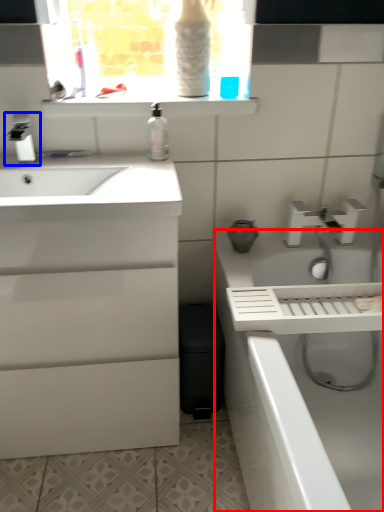
Question: Which point is further to the camera, bath (highlighted by a red box) or tap (highlighted by a blue box)?

Choices:
 (A) bath
 (B) tap

Answer: (B)